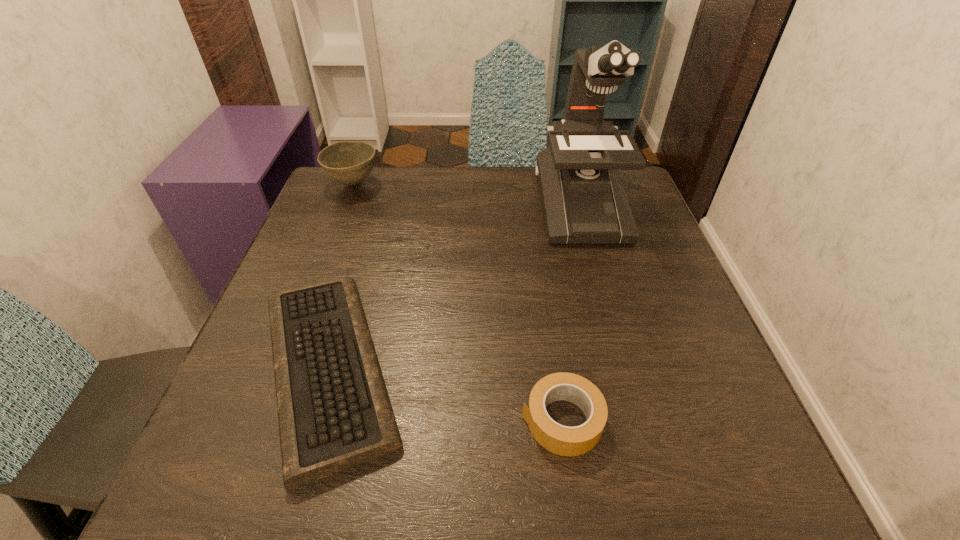
Identify the location of microscope. (584, 202).

Find the location of `bowl`. bowl is located at coordinates (350, 162).

The image size is (960, 540). Identify the location of the third tallest object. (562, 440).

Find the location of a particular element. This screenshot has width=960, height=540. the shortest object is located at coordinates (334, 412).

Locate an element on the screen. This screenshot has width=960, height=540. vacant space located through the eyepieces of the microscope is located at coordinates (605, 293).

Locate an element on the screen. This screenshot has width=960, height=540. vacant space located 0.280m on the front of the bowl is located at coordinates (319, 276).

Image resolution: width=960 pixels, height=540 pixels. I want to click on blank space located 0.150m at the edge of the third tallest object, so click(425, 420).

Locate an element on the screen. The width and height of the screenshot is (960, 540). free location located 0.350m at the edge of the third tallest object is located at coordinates (296, 420).

This screenshot has width=960, height=540. I want to click on free point located at the edge of the third tallest object, so click(x=367, y=420).

Identify the location of vacant space located on the right of the shortest object. This screenshot has width=960, height=540. (491, 368).